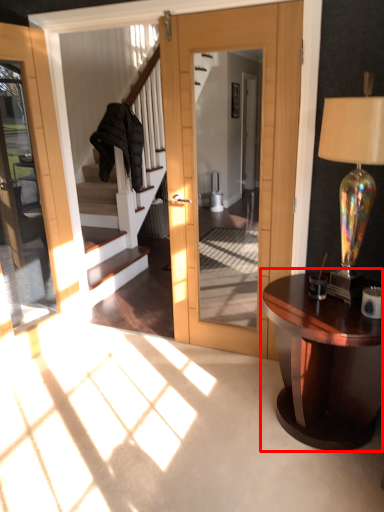
Question: From the image's perspective, what is the correct spatial relationship of table (annotated by the red box) in relation to lamp?

Choices:
 (A) above
 (B) below

Answer: (B)